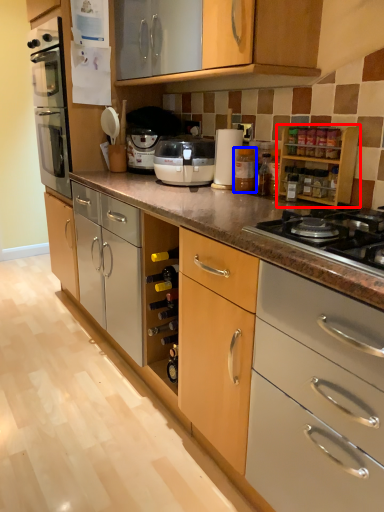
Question: Which point is further to the camera, cabinetry (highlighted by a red box) or bottle (highlighted by a blue box)?

Choices:
 (A) cabinetry
 (B) bottle

Answer: (B)